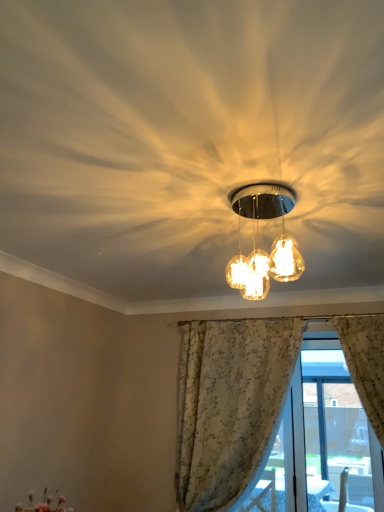
Question: Does white floral curtain at lower right lie behind matte glass globe at center?

Choices:
 (A) no
 (B) yes

Answer: (B)

Question: Is white floral curtain at lower right located outside matte glass globe at center?

Choices:
 (A) yes
 (B) no

Answer: (A)

Question: Considering the relative sizes of white floral curtain at lower right and matte glass globe at center in the image provided, is white floral curtain at lower right shorter than matte glass globe at center?

Choices:
 (A) yes
 (B) no

Answer: (B)

Question: Would you say white floral curtain at lower right is a long distance from matte glass globe at center?

Choices:
 (A) no
 (B) yes

Answer: (B)

Question: Does white floral curtain at lower right have a greater width compared to matte glass globe at center?

Choices:
 (A) no
 (B) yes

Answer: (A)

Question: From the image's perspective, is white floral curtain at lower right below matte glass globe at center?

Choices:
 (A) yes
 (B) no

Answer: (A)

Question: Is matte glass globe at center to the left of white lace curtain at center from the viewer's perspective?

Choices:
 (A) yes
 (B) no

Answer: (A)

Question: From the image's perspective, is matte glass globe at center over white lace curtain at center?

Choices:
 (A) no
 (B) yes

Answer: (B)

Question: Is matte glass globe at center oriented away from white lace curtain at center?

Choices:
 (A) no
 (B) yes

Answer: (B)

Question: From the image's perspective, does matte glass globe at center appear lower than white lace curtain at center?

Choices:
 (A) yes
 (B) no

Answer: (B)

Question: Is matte glass globe at center directly adjacent to white lace curtain at center?

Choices:
 (A) yes
 (B) no

Answer: (B)

Question: Considering the relative sizes of matte glass globe at center and white lace curtain at center in the image provided, is matte glass globe at center wider than white lace curtain at center?

Choices:
 (A) yes
 (B) no

Answer: (B)

Question: From the image's perspective, is matte glass globe at center below white floral curtain at lower right?

Choices:
 (A) yes
 (B) no

Answer: (B)